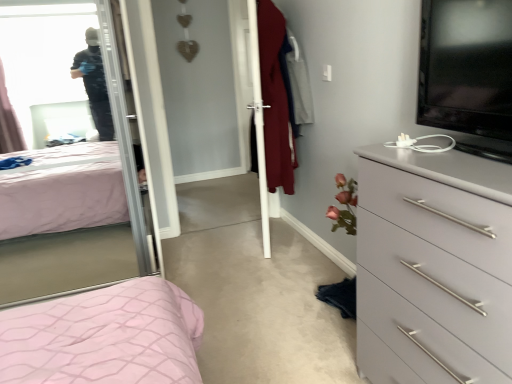
Describe the element at coordinates (250, 97) in the screenshot. I see `white glossy screen door at center` at that location.

What is the approximate width of clear glass mirror at upper left?

The width of clear glass mirror at upper left is 25.29 inches.

Locate an element on the screen. The image size is (512, 384). gray matte chest of drawers at right is located at coordinates (433, 267).

At what (x,y) coordinates should I click in order to perform the action: click on black glossy tv at upper right. Please return your answer as a coordinate pair (x, y). Looking at the image, I should click on (468, 73).

Is point (387, 221) in front of point (258, 162)?

Yes, it is in front of point (258, 162).

Is white glossy screen door at center surrounded by gray matte chest of drawers at right?

That's incorrect, white glossy screen door at center is not inside gray matte chest of drawers at right.

From the image's perspective, is gray matte chest of drawers at right on top of white glossy screen door at center?

No, from the image's perspective, gray matte chest of drawers at right is not above white glossy screen door at center.

Is gray matte chest of drawers at right at the right side of white glossy screen door at center?

Correct, you'll find gray matte chest of drawers at right to the right of white glossy screen door at center.

Considering the relative sizes of white glossy screen door at center and gray matte chest of drawers at right in the image provided, is white glossy screen door at center shorter than gray matte chest of drawers at right?

In fact, white glossy screen door at center may be taller than gray matte chest of drawers at right.

From a real-world perspective, which object stands above the other?

In real-world perspective, white glossy screen door at center is above.

Which object is further away from the camera, white glossy screen door at center or gray matte chest of drawers at right?

Positioned behind is white glossy screen door at center.

Does white glossy screen door at center have a larger size compared to gray matte chest of drawers at right?

No, white glossy screen door at center is not bigger than gray matte chest of drawers at right.

From the picture: From a real-world perspective, is black glossy tv at upper right physically above white glossy screen door at center?

Indeed, from a real-world perspective, black glossy tv at upper right stands above white glossy screen door at center.

In terms of height, does black glossy tv at upper right look taller or shorter compared to white glossy screen door at center?

In the image, black glossy tv at upper right appears to be shorter than white glossy screen door at center.

Does point (481, 155) appear closer or farther from the camera than point (234, 27)?

Point (481, 155) is positioned closer to the camera compared to point (234, 27).

Is black glossy tv at upper right oriented towards white glossy screen door at center?

No.

From the image's perspective, is clear glass mirror at upper left beneath black glossy tv at upper right?

Yes, from the image's perspective, clear glass mirror at upper left is beneath black glossy tv at upper right.

Does clear glass mirror at upper left appear on the right side of black glossy tv at upper right?

In fact, clear glass mirror at upper left is to the left of black glossy tv at upper right.

In terms of width, does clear glass mirror at upper left look wider or thinner when compared to black glossy tv at upper right?

clear glass mirror at upper left is wider than black glossy tv at upper right.

Between point (8, 267) and point (464, 63), which one is positioned behind?

The point (8, 267) is farther from the camera.

Would you say black glossy tv at upper right contains gray matte chest of drawers at right?

That's incorrect, gray matte chest of drawers at right is not inside black glossy tv at upper right.

From a real-world perspective, is black glossy tv at upper right on top of gray matte chest of drawers at right?

Yes, from a real-world perspective, black glossy tv at upper right is above gray matte chest of drawers at right.

At what (x,y) coordinates should I click in order to perform the action: click on chest of drawers on the right side of black glossy tv at upper right. Please return your answer as a coordinate pair (x, y). Looking at the image, I should click on (433, 267).

Which is behind, black glossy tv at upper right or gray matte chest of drawers at right?

black glossy tv at upper right is further from the camera.

In the image, is white glossy screen door at center on the left side or the right side of black glossy tv at upper right?

From the image, it's evident that white glossy screen door at center is to the left of black glossy tv at upper right.

From the image's perspective, does white glossy screen door at center appear higher than black glossy tv at upper right?

Yes, from the image's perspective, white glossy screen door at center is above black glossy tv at upper right.

In terms of width, does white glossy screen door at center look wider or thinner when compared to black glossy tv at upper right?

white glossy screen door at center is wider than black glossy tv at upper right.

Is white glossy screen door at center bigger or smaller than black glossy tv at upper right?

white glossy screen door at center is bigger than black glossy tv at upper right.

Identify the location of mirror on the left of gray matte chest of drawers at right. (76, 207).

Is clear glass mirror at upper left next to gray matte chest of drawers at right and touching it?

No, clear glass mirror at upper left is not beside gray matte chest of drawers at right.

Is clear glass mirror at upper left to the left of gray matte chest of drawers at right from the viewer's perspective?

Indeed, clear glass mirror at upper left is positioned on the left side of gray matte chest of drawers at right.

The width and height of the screenshot is (512, 384). In order to click on screen door on the left of gray matte chest of drawers at right in this screenshot , I will do `click(250, 97)`.

Find the location of `the chest of drawers directly beneath the white glossy screen door at center (from a real-world perspective)`. the chest of drawers directly beneath the white glossy screen door at center (from a real-world perspective) is located at coordinates (433, 267).

From the image, which object appears to be farther from white glossy screen door at center, clear glass mirror at upper left or black glossy tv at upper right?

black glossy tv at upper right.

Looking at the image, which one is located further to black glossy tv at upper right, clear glass mirror at upper left or white glossy screen door at center?

Based on the image, white glossy screen door at center appears to be further to black glossy tv at upper right.

Based on their spatial positions, is black glossy tv at upper right or gray matte chest of drawers at right closer to clear glass mirror at upper left?

The object closer to clear glass mirror at upper left is gray matte chest of drawers at right.

From the image, which object appears to be nearer to gray matte chest of drawers at right, black glossy tv at upper right or white glossy screen door at center?

black glossy tv at upper right.

When comparing their distances from black glossy tv at upper right, does gray matte chest of drawers at right or clear glass mirror at upper left seem further?

Among the two, clear glass mirror at upper left is located further to black glossy tv at upper right.

Which object lies further to the anchor point gray matte chest of drawers at right, black glossy tv at upper right or clear glass mirror at upper left?

Among the two, clear glass mirror at upper left is located further to gray matte chest of drawers at right.

Looking at the image, which one is located further to white glossy screen door at center, black glossy tv at upper right or gray matte chest of drawers at right?

The object further to white glossy screen door at center is gray matte chest of drawers at right.

Considering their positions, is gray matte chest of drawers at right positioned closer to white glossy screen door at center than clear glass mirror at upper left?

clear glass mirror at upper left is closer to white glossy screen door at center.

Identify the location of television between clear glass mirror at upper left and gray matte chest of drawers at right from left to right. (468, 73).

Where is `screen door between clear glass mirror at upper left and black glossy tv at upper right from left to right`? screen door between clear glass mirror at upper left and black glossy tv at upper right from left to right is located at coordinates (250, 97).

Where is `screen door situated between clear glass mirror at upper left and gray matte chest of drawers at right from left to right`? screen door situated between clear glass mirror at upper left and gray matte chest of drawers at right from left to right is located at coordinates (250, 97).

Where is `television located between gray matte chest of drawers at right and white glossy screen door at center in the depth direction`? The width and height of the screenshot is (512, 384). television located between gray matte chest of drawers at right and white glossy screen door at center in the depth direction is located at coordinates (468, 73).